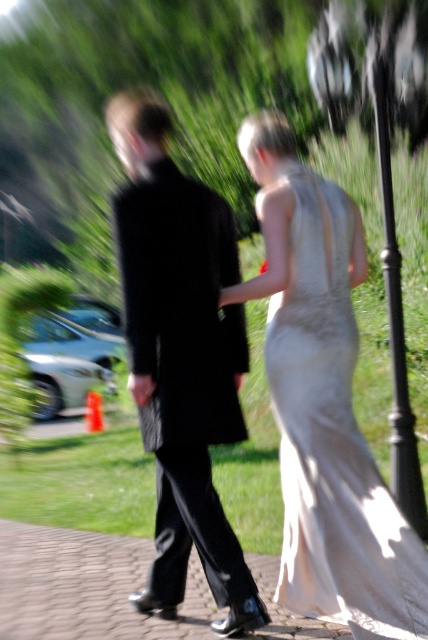
Question: Which of the following is the closest to the observer?

Choices:
 (A) (323, 624)
 (B) (192, 189)
 (C) (329, 346)

Answer: (C)

Question: Is the position of black velvet suit at center less distant than that of ivory satin dress at center?

Choices:
 (A) no
 (B) yes

Answer: (A)

Question: Does black velvet suit at center have a larger size compared to ivory satin dress at center?

Choices:
 (A) no
 (B) yes

Answer: (A)

Question: Can you confirm if ivory satin dress at center is positioned to the right of paved stone walkway at center?

Choices:
 (A) no
 (B) yes

Answer: (B)

Question: Estimate the real-world distances between objects in this image. Which object is farther from the black velvet suit at center?

Choices:
 (A) ivory satin dress at center
 (B) paved stone walkway at center

Answer: (B)

Question: Which point appears farthest from the camera in this image?

Choices:
 (A) (80, 627)
 (B) (228, 308)

Answer: (B)